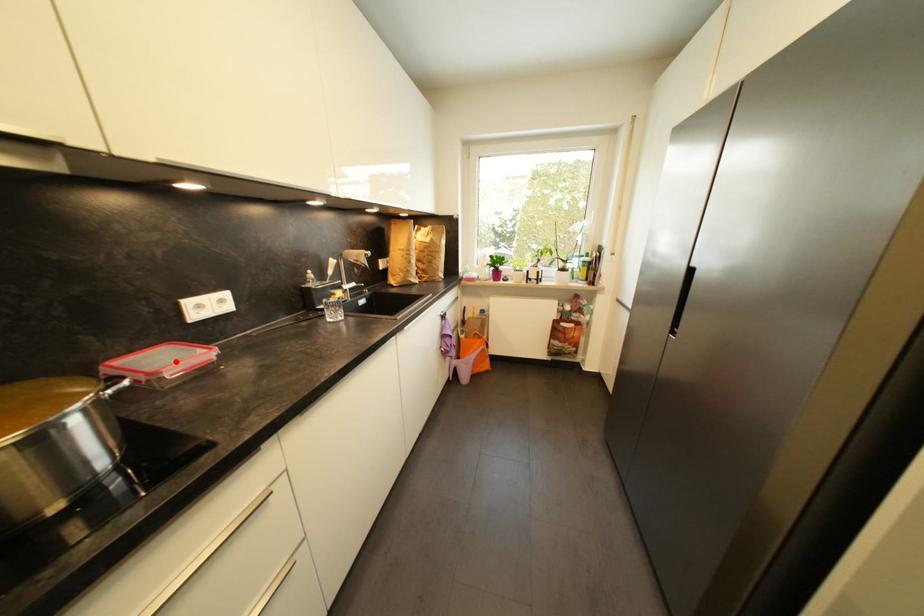
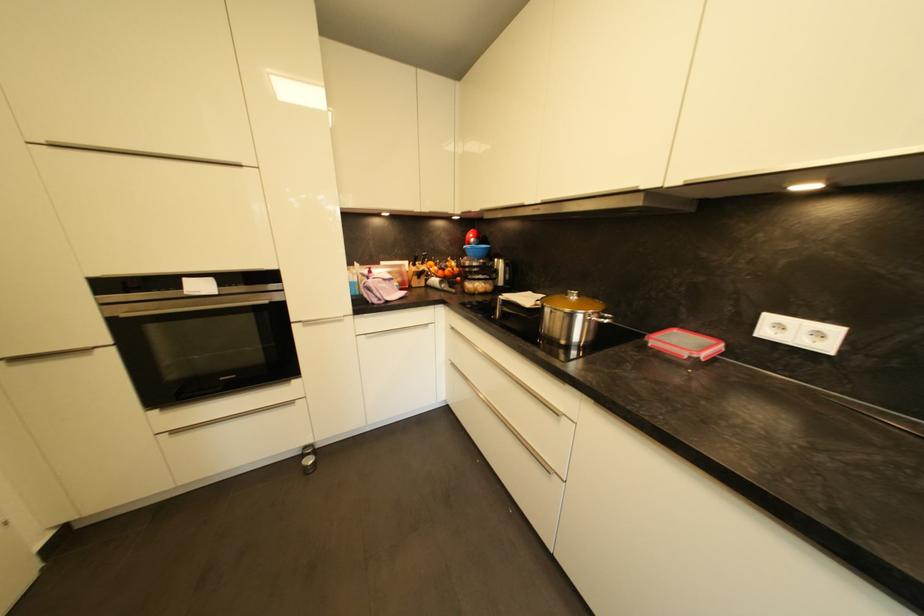
The point at the highlighted location is marked in the first image. Where is the corresponding point in the second image?

(686, 345)